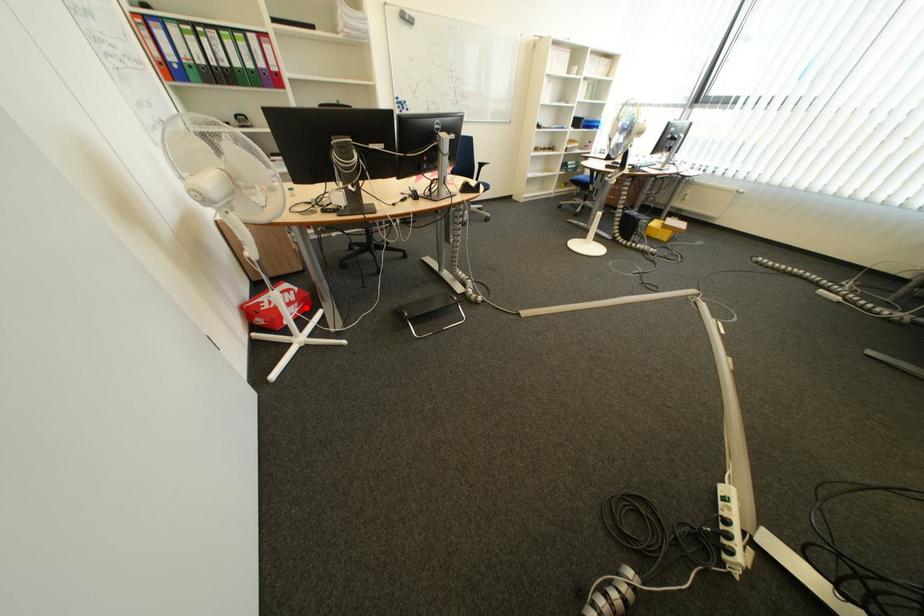
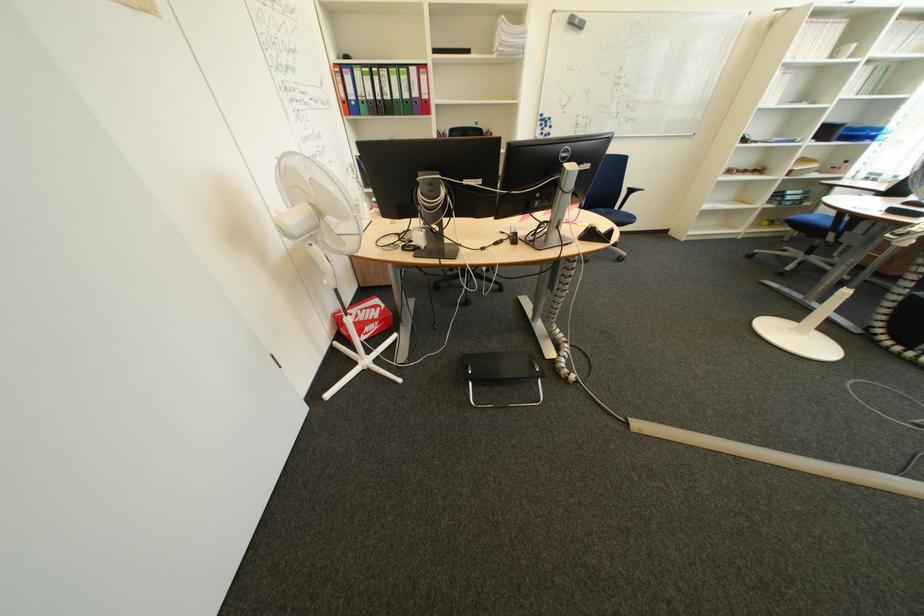
Question: I am providing you with two images of the same scene from different viewpoints. In image1, a red point is highlighted. Considering the same 3D point in image2, which of the following is correct?

Choices:
 (A) It is closer
 (B) It is farther

Answer: (B)